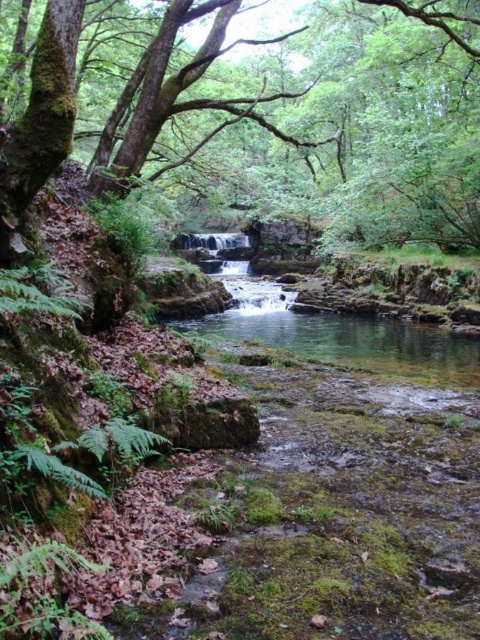
You are an environmental scientist studying the area. You need to determine which object occupies more space in the image between the green mossy tree at upper left and the clear water at center. Based on the scene description, which one is larger?

The green mossy tree at upper left is larger in size than the clear water at center, so it occupies more space in the image.

You are a hiker standing at the edge of the pool and want to take a photo of the green mossy tree at upper left and the clear water at center. Which object should you focus on first if you want to capture both in a single frame without moving the camera?

The green mossy tree at upper left is positioned on the right side of clear water at center, so you should focus on the clear water at center first to ensure both are in the frame.